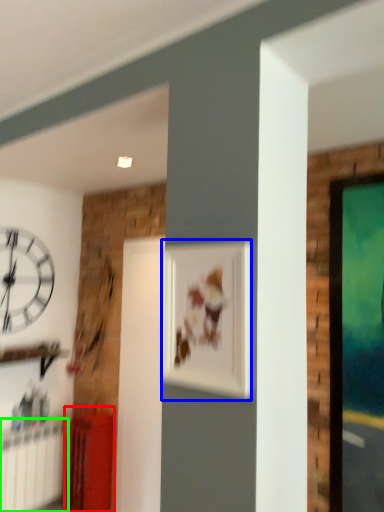
Question: Which object is the farthest from furniture (highlighted by a red box)? Choose among these: picture frame (highlighted by a blue box) or radiator (highlighted by a green box).

Choices:
 (A) picture frame
 (B) radiator

Answer: (A)